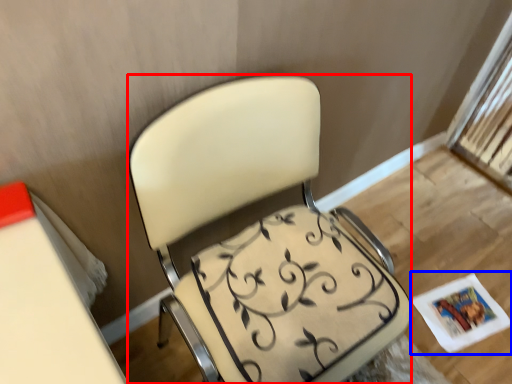
Question: Among these objects, which one is nearest to the camera, chair (highlighted by a red box) or magazine (highlighted by a blue box)?

Choices:
 (A) chair
 (B) magazine

Answer: (A)